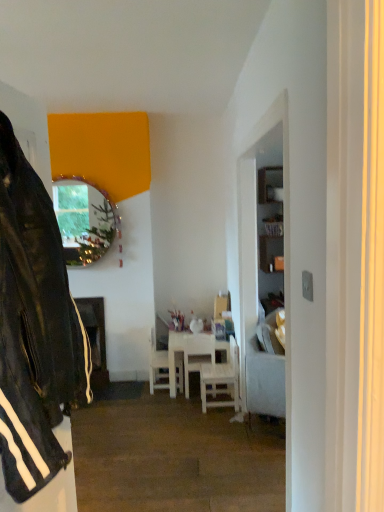
Question: From the image's perspective, is metallic reflective mirror at upper left under light gray fabric couch at right?

Choices:
 (A) no
 (B) yes

Answer: (A)

Question: Is metallic reflective mirror at upper left wider than light gray fabric couch at right?

Choices:
 (A) yes
 (B) no

Answer: (B)

Question: Is metallic reflective mirror at upper left to the right of light gray fabric couch at right from the viewer's perspective?

Choices:
 (A) no
 (B) yes

Answer: (A)

Question: Is metallic reflective mirror at upper left shorter than light gray fabric couch at right?

Choices:
 (A) no
 (B) yes

Answer: (A)

Question: From a real-world perspective, does metallic reflective mirror at upper left stand above light gray fabric couch at right?

Choices:
 (A) no
 (B) yes

Answer: (B)

Question: From a real-world perspective, is black leather jacket at left above or below white wood chair at center, which is the 3th chair from right to left?

Choices:
 (A) below
 (B) above

Answer: (B)

Question: Which is correct: black leather jacket at left is inside white wood chair at center, which is the 3th chair from right to left, or outside of it?

Choices:
 (A) inside
 (B) outside

Answer: (B)

Question: From the image's perspective, is black leather jacket at left positioned above or below white wood chair at center, the 1th chair from the left?

Choices:
 (A) above
 (B) below

Answer: (A)

Question: Is black leather jacket at left bigger or smaller than white wood chair at center, which is the 3th chair from right to left?

Choices:
 (A) small
 (B) big

Answer: (B)

Question: Considering the positions of white wooden chair at center, which is the 1th chair from right to left, and black leather jacket at left in the image, is white wooden chair at center, which is the 1th chair from right to left, bigger or smaller than black leather jacket at left?

Choices:
 (A) small
 (B) big

Answer: (A)

Question: Is white wooden chair at center, which ranks as the 3th chair in left-to-right order, taller or shorter than black leather jacket at left?

Choices:
 (A) tall
 (B) short

Answer: (B)

Question: Considering their positions, is white wooden chair at center, which is the 1th chair from right to left, located in front of or behind black leather jacket at left?

Choices:
 (A) behind
 (B) front

Answer: (A)

Question: From a real-world perspective, is white wooden chair at center, which is the 1th chair from right to left, physically located above or below black leather jacket at left?

Choices:
 (A) above
 (B) below

Answer: (B)

Question: Based on their positions, is white wood chair at center, which is the 2th chair from left to right, located to the left or right of white wooden chair at center, which ranks as the 3th chair in left-to-right order?

Choices:
 (A) left
 (B) right

Answer: (A)

Question: Looking at the image, does white wood chair at center, which is the 2th chair from left to right, seem bigger or smaller compared to white wooden chair at center, which ranks as the 3th chair in left-to-right order?

Choices:
 (A) big
 (B) small

Answer: (B)